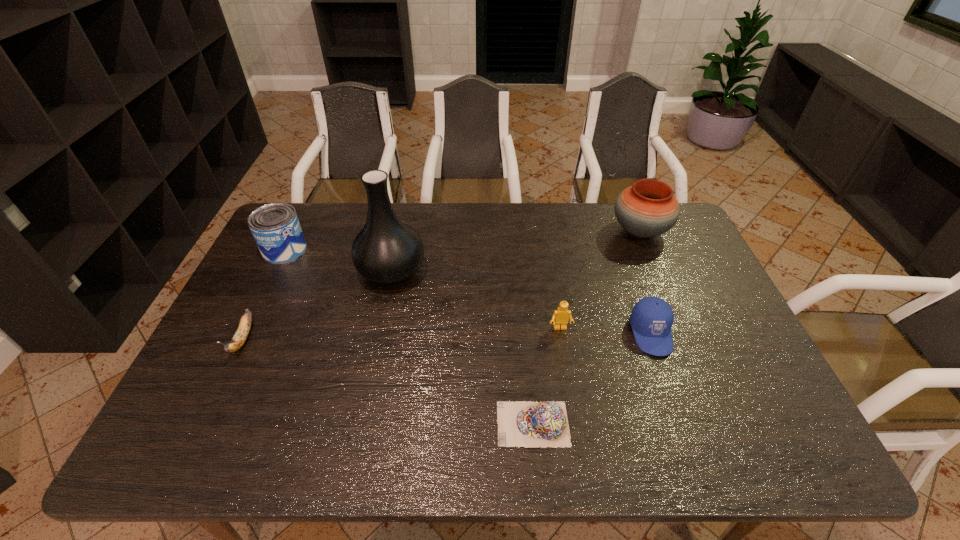
Where is `free space at the right edge of the desktop`? The height and width of the screenshot is (540, 960). free space at the right edge of the desktop is located at coordinates (719, 345).

Identify the location of blank region between the Lego and the banana. (402, 334).

The height and width of the screenshot is (540, 960). What are the coordinates of `vacant area between the banana and the left cap` in the screenshot? It's located at (388, 382).

Locate an element on the screen. The width and height of the screenshot is (960, 540). free space that is in between the farther cap and the Lego is located at coordinates (606, 331).

Where is `empty space between the third object from left to right and the banana`? This screenshot has height=540, width=960. empty space between the third object from left to right and the banana is located at coordinates (318, 305).

Identify the location of vacant space that's between the farther cap and the nearest object. (592, 379).

This screenshot has width=960, height=540. I want to click on vacant point located between the Lego and the third tallest object, so click(422, 289).

This screenshot has height=540, width=960. Find the location of `vacant space that is in between the banana and the second tallest object`. vacant space that is in between the banana and the second tallest object is located at coordinates (442, 285).

At what (x,y) coordinates should I click in order to perform the action: click on empty location between the third object from left to right and the can. Please return your answer as a coordinate pair (x, y). Looking at the image, I should click on (338, 260).

Where is `vacant space in between the shortest object and the banana`? vacant space in between the shortest object and the banana is located at coordinates (388, 382).